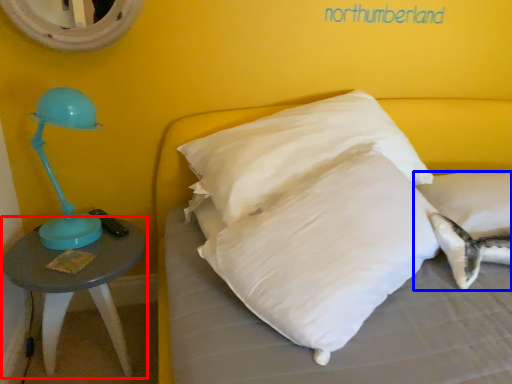
Question: Which object is further to the camera taking this photo, table (highlighted by a red box) or pillow (highlighted by a blue box)?

Choices:
 (A) table
 (B) pillow

Answer: (B)